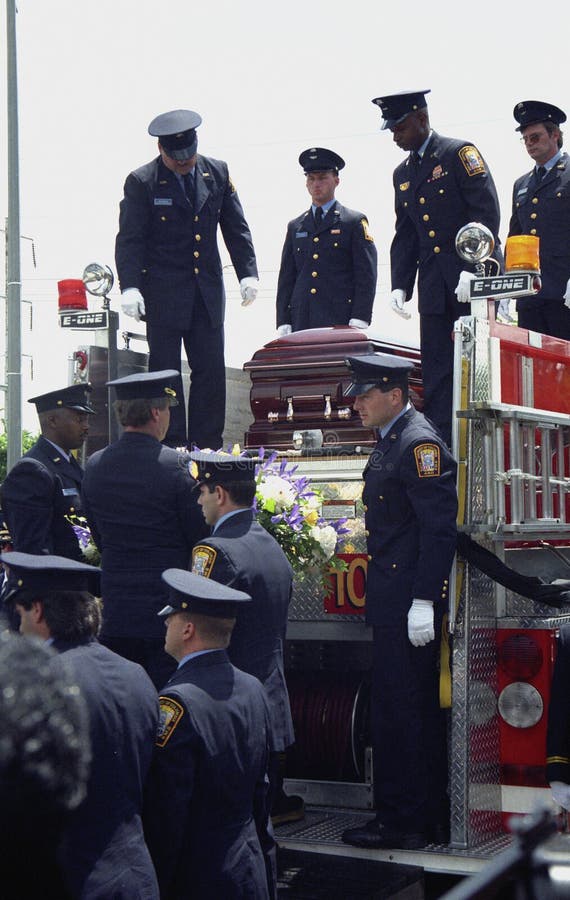
The height and width of the screenshot is (900, 570). What are the coordinates of `emergency lights` in the screenshot? It's located at (521, 256), (73, 299).